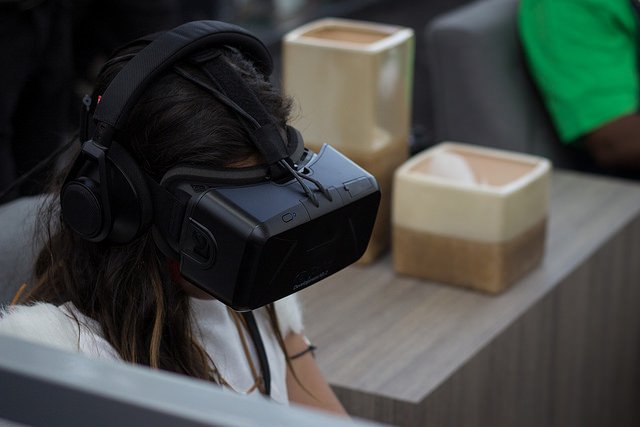
The image size is (640, 427). What are the coordinates of `chair` in the screenshot? It's located at (467, 58), (13, 242).